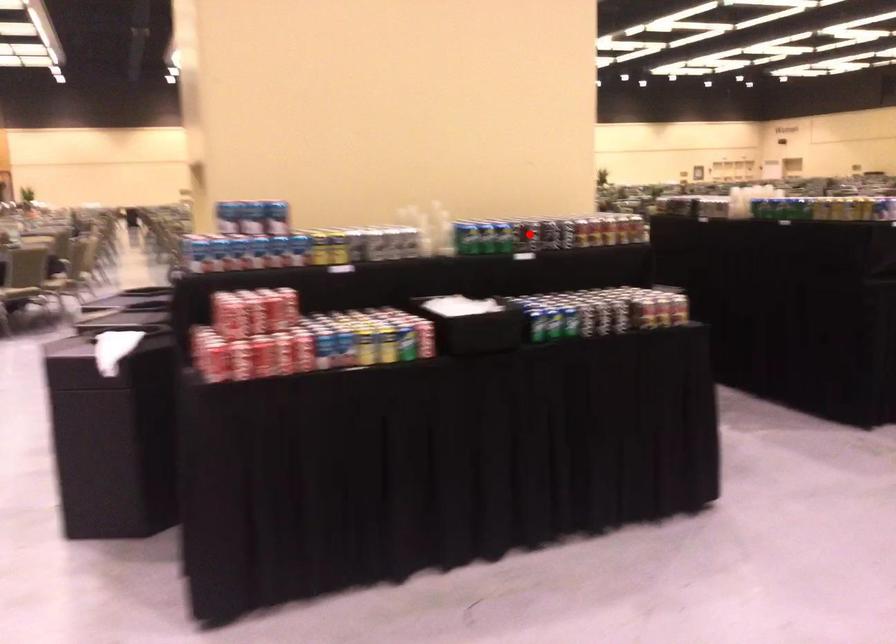
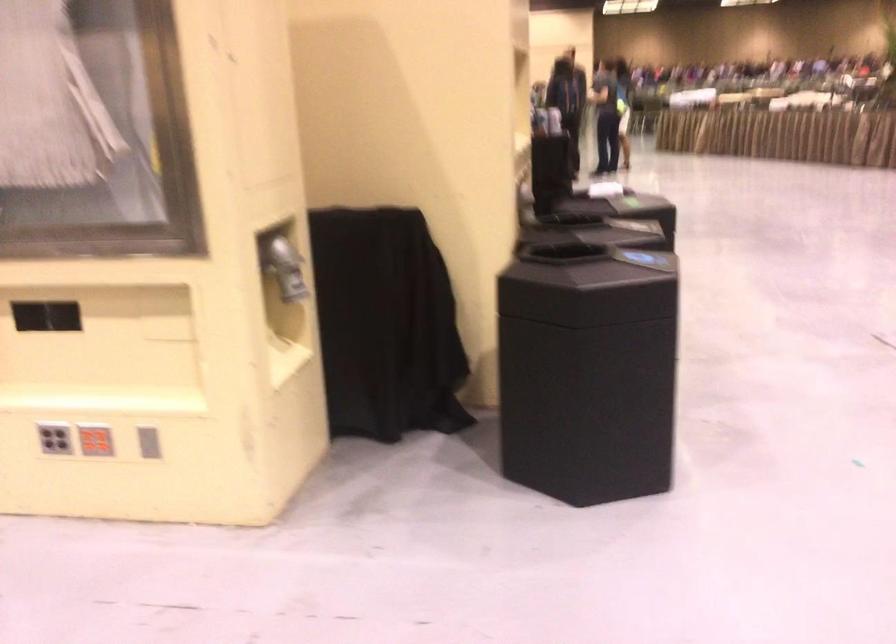
Question: I am providing you with two images of the same scene from different viewpoints. A red point is marked on the first image. At the location where the point appears in image 1, is it still visible in image 2?

Choices:
 (A) Yes
 (B) No

Answer: (B)